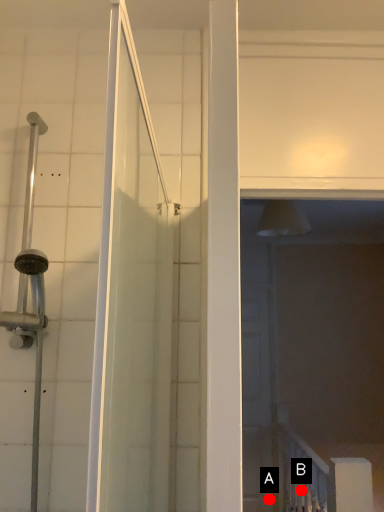
Question: Two points are circled on the image, labeled by A and B beside each circle. Among these points, which one is nearest to the camera?

Choices:
 (A) A is closer
 (B) B is closer

Answer: (B)